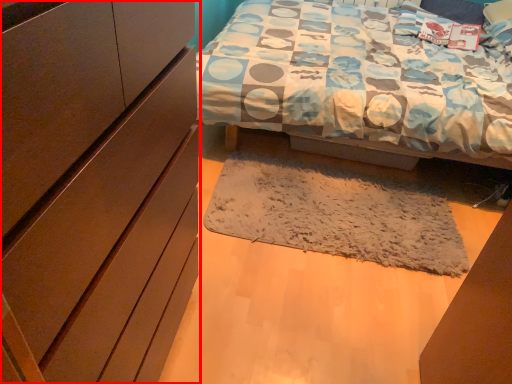
Question: From the image's perspective, where is cabinetry (annotated by the red box) located in relation to mat in the image?

Choices:
 (A) above
 (B) below

Answer: (B)